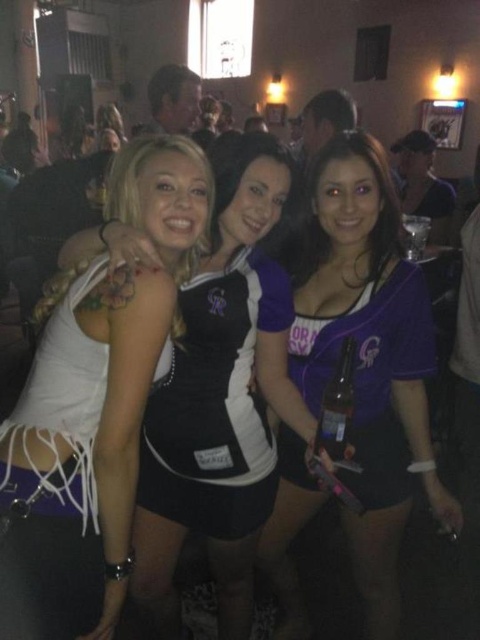
Which is behind, point (346, 531) or point (219, 326)?

Point (346, 531)

Is point (402, 312) behind point (165, 474)?

That is False.

Does point (398, 515) come closer to viewer compared to point (192, 492)?

Yes, it is.

Locate an element on the screen. purple matte shirt at center is located at coordinates (x=368, y=355).

Between purple matte shirt at center and clear glass bottle at center, which one is positioned lower?

purple matte shirt at center is lower down.

Does point (360, 193) come farther from viewer compared to point (337, 362)?

Yes, point (360, 193) is farther from viewer.

The width and height of the screenshot is (480, 640). What do you see at coordinates (368, 355) in the screenshot?
I see `purple matte shirt at center` at bounding box center [368, 355].

Find the location of a particular element. This screenshot has width=480, height=640. purple matte shirt at center is located at coordinates coord(368,355).

Is purple matte shirt at center in front of white lace skirt at left?

No.

Is point (424, 481) farther from viewer compared to point (126, 547)?

Yes, it is.

Locate an element on the screen. purple matte shirt at center is located at coordinates (368, 355).

Where is `purple matte shirt at center`? Image resolution: width=480 pixels, height=640 pixels. purple matte shirt at center is located at coordinates (368, 355).